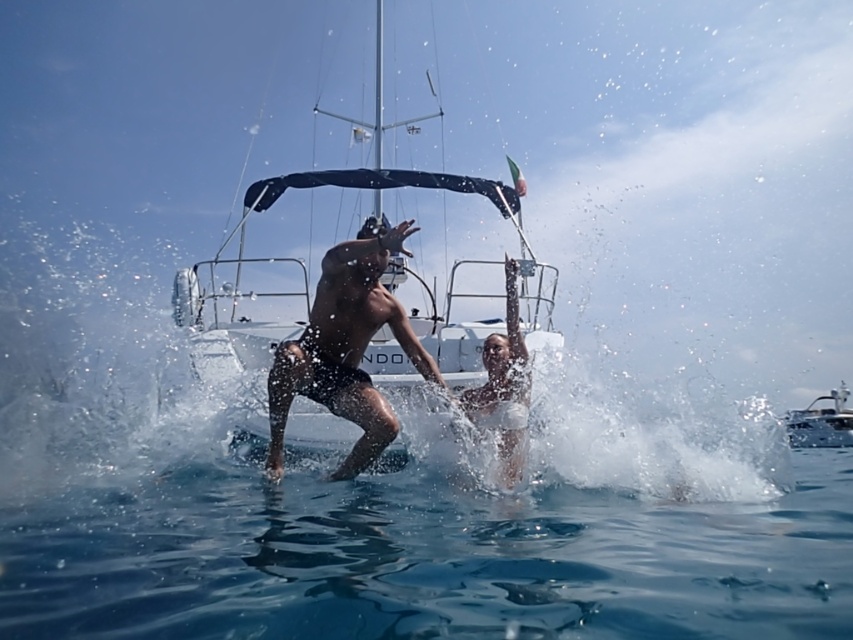
You are a photographer trying to capture the perfect shot of the two people in the water. You want to ensure both the brown matte skin at center and the white matte bikini at center are clearly visible. Based on their positions, which object should you focus on first to ensure both are in frame?

Since the brown matte skin at center is to the left of the white matte bikini at center, you should focus on the brown matte skin at center first to ensure both are in frame.

You are a photographer trying to capture a clear shot of the brown matte skin at center and the white matte bikini at center in the water. Which object should you focus on first to ensure it appears larger in the photo?

The brown matte skin at center is much taller than the white matte bikini at center, so focusing on the brown matte skin at center first will ensure it appears larger in the photo.